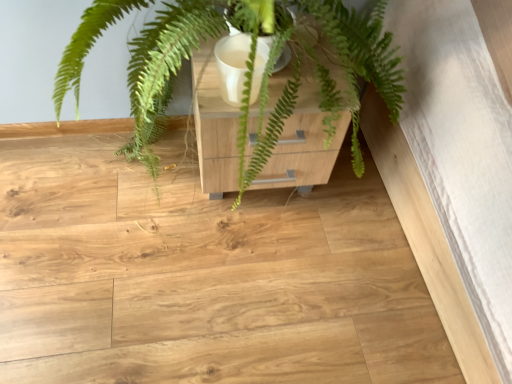
Find the location of a particular element. This screenshot has height=384, width=512. free region on the left part of wooden dresser at center is located at coordinates (141, 183).